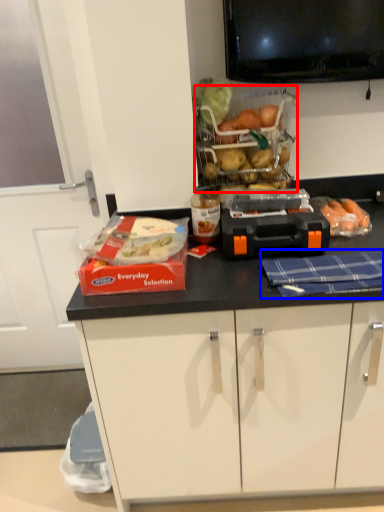
Question: Which object is further to the camera taking this photo, basket (highlighted by a red box) or blanket (highlighted by a blue box)?

Choices:
 (A) basket
 (B) blanket

Answer: (A)